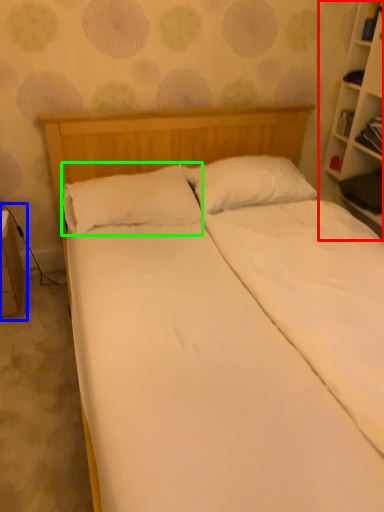
Question: Based on their relative distances, which object is nearer to bookcase (highlighted by a red box)? Choose from table (highlighted by a blue box) and pillow (highlighted by a green box).

Choices:
 (A) table
 (B) pillow

Answer: (B)